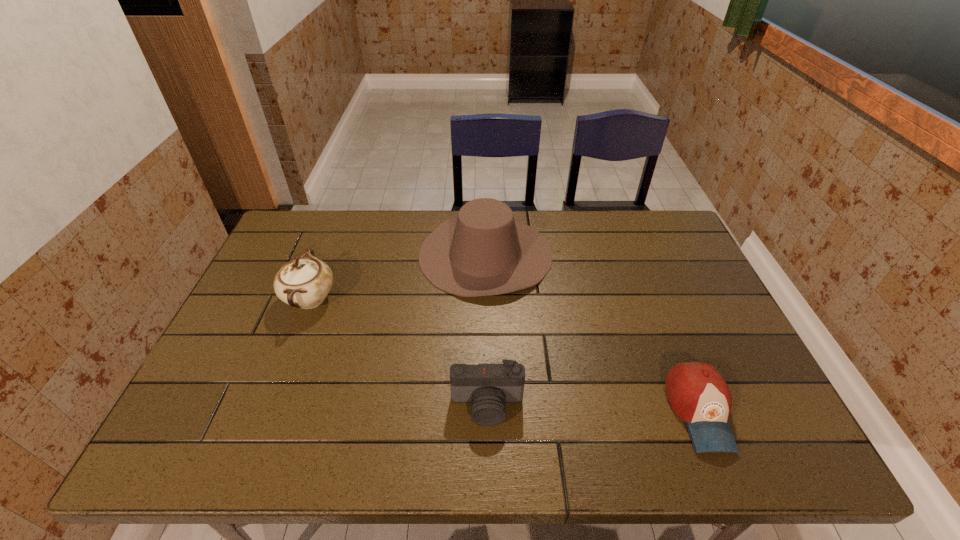
In order to click on free space between the camera and the cowboy hat in this screenshot , I will do `click(487, 330)`.

Locate an element on the screen. The height and width of the screenshot is (540, 960). vacant area between the baseball cap and the camera is located at coordinates (593, 409).

Identify the location of free area in between the shortest object and the camera. Image resolution: width=960 pixels, height=540 pixels. (593, 409).

Locate an element on the screen. Image resolution: width=960 pixels, height=540 pixels. vacant area between the cowboy hat and the camera is located at coordinates (487, 330).

The width and height of the screenshot is (960, 540). I want to click on vacant area that lies between the cowboy hat and the shortest object, so click(592, 333).

Image resolution: width=960 pixels, height=540 pixels. What are the coordinates of `free space between the rightmost object and the chinaware` in the screenshot? It's located at (505, 355).

Where is `empty space that is in between the rightmost object and the chinaware`? empty space that is in between the rightmost object and the chinaware is located at coordinates (505, 355).

Where is `empty space between the shortest object and the cowboy hat`? This screenshot has width=960, height=540. empty space between the shortest object and the cowboy hat is located at coordinates (592, 333).

This screenshot has height=540, width=960. In order to click on empty location between the camera and the leftmost object in this screenshot , I will do `click(398, 352)`.

Find the location of a particular element. free space between the rightmost object and the cowboy hat is located at coordinates (592, 333).